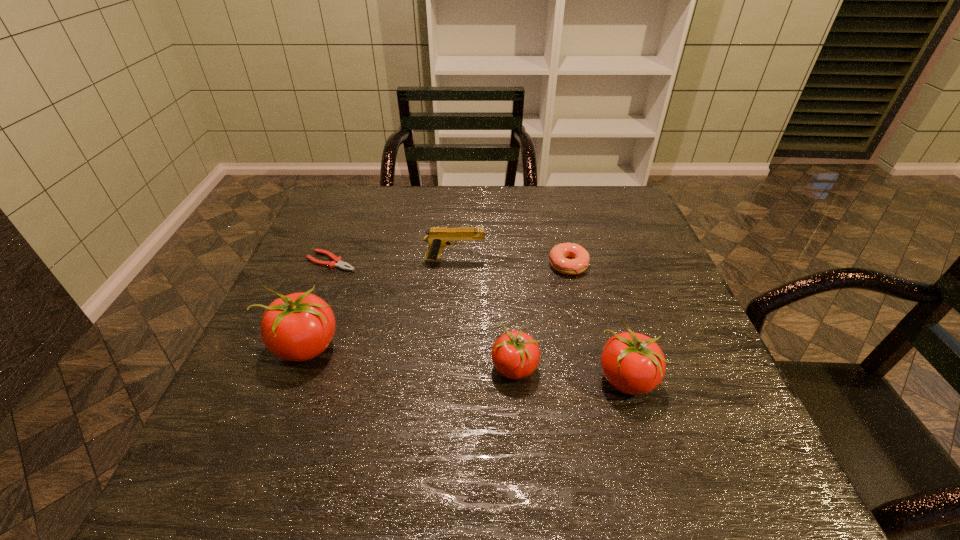
Where is `empty space that is in between the pliers and the pistol`? empty space that is in between the pliers and the pistol is located at coordinates (394, 261).

Find the location of a particular element. The width and height of the screenshot is (960, 540). vacant region between the rightmost tomato and the pistol is located at coordinates (540, 319).

You are a GUI agent. You are given a task and a screenshot of the screen. Output one action in this format:
    pyautogui.click(x=<x>, y=<y>)
    Task: Click on the empty space between the tallest object and the second shortest tomato
    This screenshot has width=960, height=540.
    Given the screenshot: What is the action you would take?
    pyautogui.click(x=467, y=363)

Locate an element on the screen. The image size is (960, 540). vacant region between the third object from left to right and the pliers is located at coordinates (394, 261).

Locate an element on the screen. empty location between the rightmost tomato and the pistol is located at coordinates (540, 319).

Select which object is the fifth closest to the doughnut. Please provide its 2D coordinates. Your answer should be formatted as a tuple, i.e. [(x, y)], where the tuple contains the x and y coordinates of a point satisfying the conditions above.

[(337, 261)]

Select which object is the closest to the third object from right to left. Please provide its 2D coordinates. Your answer should be formatted as a tuple, i.e. [(x, y)], where the tuple contains the x and y coordinates of a point satisfying the conditions above.

[(633, 363)]

Identify which tomato is the second nearest to the tallest tomato. Please provide its 2D coordinates. Your answer should be formatted as a tuple, i.e. [(x, y)], where the tuple contains the x and y coordinates of a point satisfying the conditions above.

[(633, 363)]

Identify the location of tomato that stands as the closest to the doughnut. The width and height of the screenshot is (960, 540). (515, 354).

Identify the location of free region that satisfies the following two spatial constraints: 1. at the barrel of the shortest tomato; 2. on the right side of the third object from left to right. (447, 368).